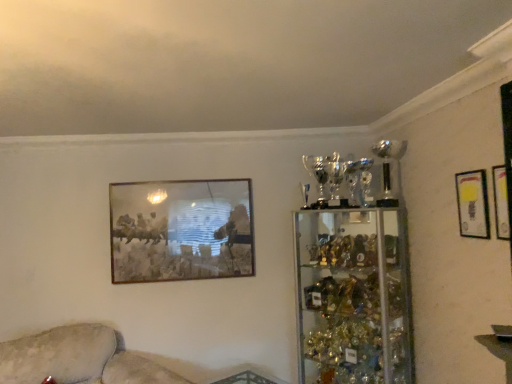
Question: Is metallic gold picture frame at upper center, the 3th picture frame from the right, at the back of matte gold picture frame at upper right, the second picture frame viewed from the right?

Choices:
 (A) no
 (B) yes

Answer: (A)

Question: Does matte gold picture frame at upper right, the second picture frame in the front-to-back sequence, contain metallic gold picture frame at upper center, which is the 1th picture frame in back-to-front order?

Choices:
 (A) yes
 (B) no

Answer: (B)

Question: Is matte gold picture frame at upper right, marked as the 2th picture frame in a left-to-right arrangement, far away from metallic gold picture frame at upper center, which is the 1th picture frame in back-to-front order?

Choices:
 (A) yes
 (B) no

Answer: (A)

Question: Is matte gold picture frame at upper right, which appears as the second picture frame when viewed from the back, not within metallic gold picture frame at upper center, the third picture frame in the front-to-back sequence?

Choices:
 (A) no
 (B) yes

Answer: (B)

Question: Can you confirm if matte gold picture frame at upper right, the second picture frame in the front-to-back sequence, is bigger than metallic gold picture frame at upper center, the 3th picture frame from the right?

Choices:
 (A) yes
 (B) no

Answer: (B)

Question: Looking at their shapes, would you say beige fabric couch at lower left is wider or thinner than matte gold picture frame at upper right, which is the first picture frame from front to back?

Choices:
 (A) thin
 (B) wide

Answer: (B)

Question: Based on their sizes in the image, would you say beige fabric couch at lower left is bigger or smaller than matte gold picture frame at upper right, marked as the 1th picture frame in a right-to-left arrangement?

Choices:
 (A) small
 (B) big

Answer: (B)

Question: In terms of height, does beige fabric couch at lower left look taller or shorter compared to matte gold picture frame at upper right, the 3th picture frame when ordered from left to right?

Choices:
 (A) short
 (B) tall

Answer: (B)

Question: Is point (17, 359) closer or farther from the camera than point (507, 236)?

Choices:
 (A) closer
 (B) farther

Answer: (B)

Question: Based on their sizes in the image, would you say beige fabric couch at lower left is bigger or smaller than clear glass trophy case at right?

Choices:
 (A) small
 (B) big

Answer: (B)

Question: Looking at their shapes, would you say beige fabric couch at lower left is wider or thinner than clear glass trophy case at right?

Choices:
 (A) thin
 (B) wide

Answer: (B)

Question: From the image's perspective, is beige fabric couch at lower left above or below clear glass trophy case at right?

Choices:
 (A) above
 (B) below

Answer: (B)

Question: Which is correct: beige fabric couch at lower left is inside clear glass trophy case at right, or outside of it?

Choices:
 (A) inside
 (B) outside

Answer: (B)

Question: Looking at their shapes, would you say matte gold picture frame at upper right, placed as the 3th picture frame when sorted from back to front, is wider or thinner than clear glass trophy case at right?

Choices:
 (A) thin
 (B) wide

Answer: (A)

Question: From a real-world perspective, is matte gold picture frame at upper right, the 3th picture frame when ordered from left to right, above or below clear glass trophy case at right?

Choices:
 (A) above
 (B) below

Answer: (A)